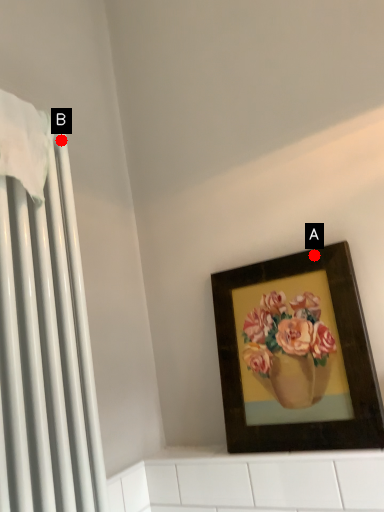
Question: Two points are circled on the image, labeled by A and B beside each circle. Which point appears closest to the camera in this image?

Choices:
 (A) A is closer
 (B) B is closer

Answer: (B)